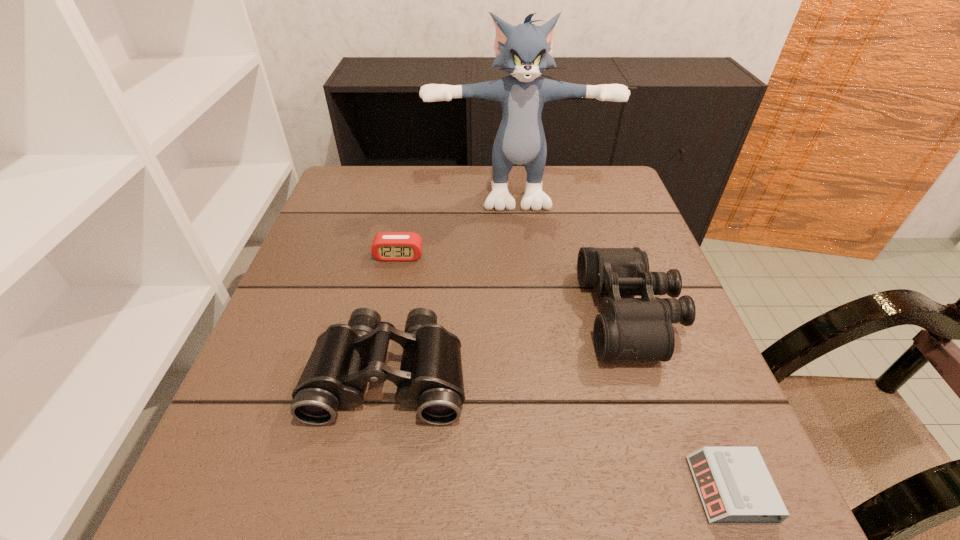
Locate an element on the screen. vacant region located at the eyepieces of the right binoculars is located at coordinates (453, 314).

At what (x,y) coordinates should I click in order to perform the action: click on vacant point located at the eyepieces of the right binoculars. Please return your answer as a coordinate pair (x, y). The width and height of the screenshot is (960, 540). Looking at the image, I should click on (478, 314).

Find the location of a particular element. vacant region located 0.080m on the front-facing side of the left binoculars is located at coordinates 371,477.

Locate an element on the screen. The width and height of the screenshot is (960, 540). vacant space located 0.250m on the front-facing side of the farther alarm clock is located at coordinates (379, 349).

This screenshot has height=540, width=960. Identify the location of vacant area situated 0.290m on the back of the shorter alarm clock. (660, 317).

I want to click on object that is positioned at the far edge, so click(525, 51).

Locate an element on the screen. This screenshot has width=960, height=540. object present at the near edge is located at coordinates click(x=735, y=486).

Locate an element on the screen. Image resolution: width=960 pixels, height=540 pixels. object at the left edge is located at coordinates (345, 357).

Identify the location of cat positioned at the right edge. (525, 51).

In order to click on binoculars situated at the right edge in this screenshot , I will do `click(641, 328)`.